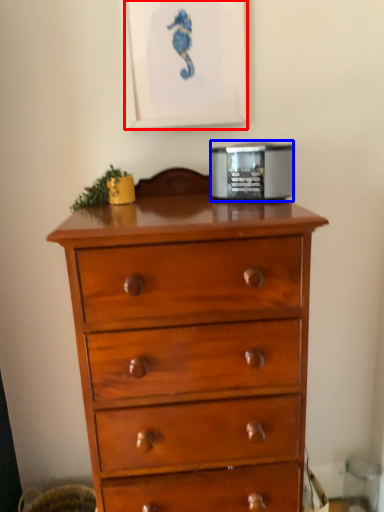
Question: Which object is closer to the camera taking this photo, picture frame (highlighted by a red box) or appliance (highlighted by a blue box)?

Choices:
 (A) picture frame
 (B) appliance

Answer: (B)